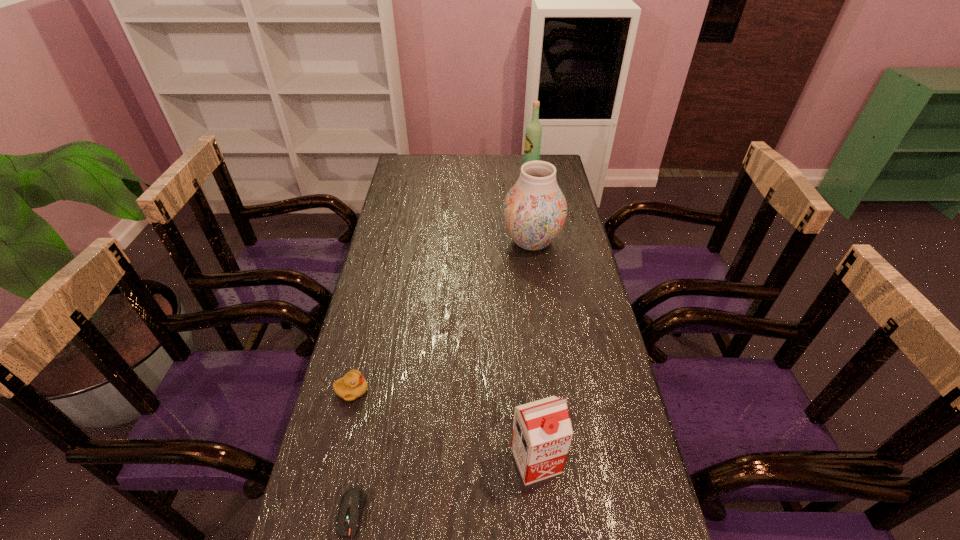
The image size is (960, 540). Identify the location of the farthest object. (533, 135).

Locate an element on the screen. This screenshot has width=960, height=540. vase is located at coordinates (534, 210).

Locate an element on the screen. The image size is (960, 540). soya milk is located at coordinates (542, 432).

You are a GUI agent. You are given a task and a screenshot of the screen. Output one action in this format:
    pyautogui.click(x=<x>, y=<y>)
    Task: Click on the fourth farthest object
    This screenshot has height=540, width=960.
    Given the screenshot: What is the action you would take?
    pyautogui.click(x=542, y=432)

Where is `the third farthest object`? the third farthest object is located at coordinates (353, 385).

This screenshot has height=540, width=960. I want to click on the fourth tallest object, so click(353, 385).

You are a GUI agent. You are given a task and a screenshot of the screen. Output one action in this format:
    pyautogui.click(x=<x>, y=<y>)
    Task: Click on the computer equipment
    The width and height of the screenshot is (960, 540).
    Given the screenshot: What is the action you would take?
    pyautogui.click(x=353, y=501)

At what (x,y) coordinates should I click in order to perform the action: click on the nearest object. Please return your answer as a coordinate pair (x, y). The image size is (960, 540). Looking at the image, I should click on (353, 501).

Locate an element on the screen. vacant space located on the front-facing side of the farthest object is located at coordinates [473, 171].

Where is `free space located on the front-facing side of the farthest object`? The height and width of the screenshot is (540, 960). free space located on the front-facing side of the farthest object is located at coordinates (442, 171).